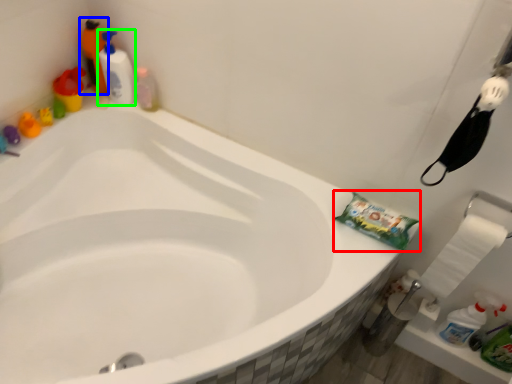
Question: Which object is positioned closest to material (highlighted by a red box)? Select from cleaning product (highlighted by a blue box) and cleaning product (highlighted by a green box).

Choices:
 (A) cleaning product
 (B) cleaning product

Answer: (B)